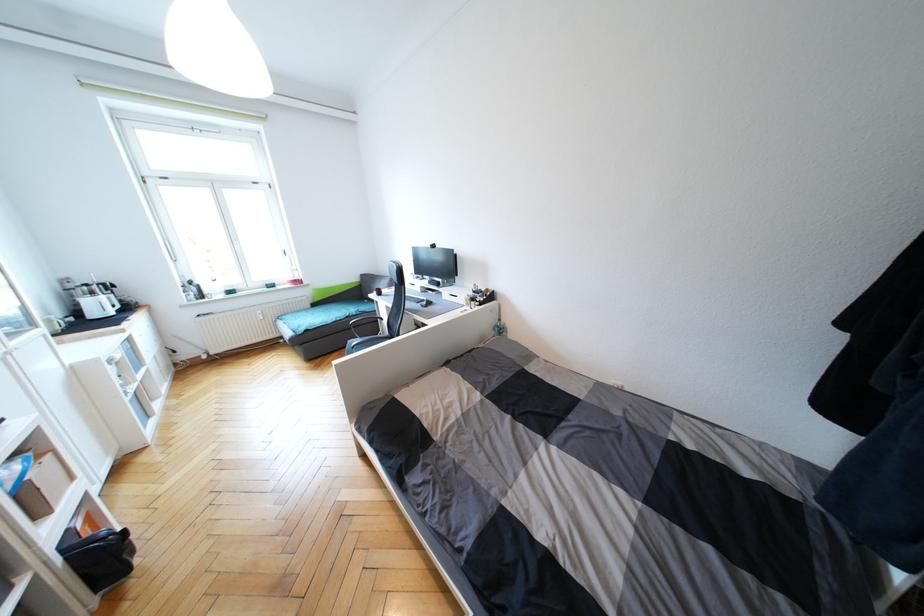
Identify the location of green glass bottle. (500, 325).